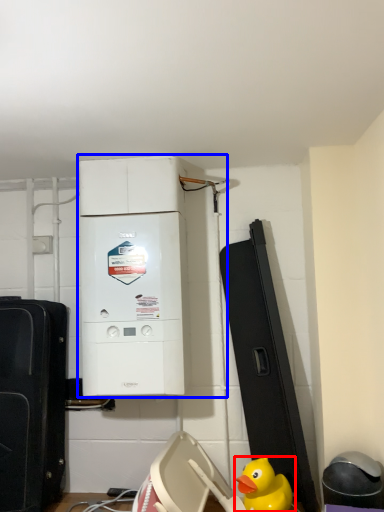
Question: Which point is further to the camera, duck (highlighted by a red box) or home appliance (highlighted by a blue box)?

Choices:
 (A) duck
 (B) home appliance

Answer: (B)